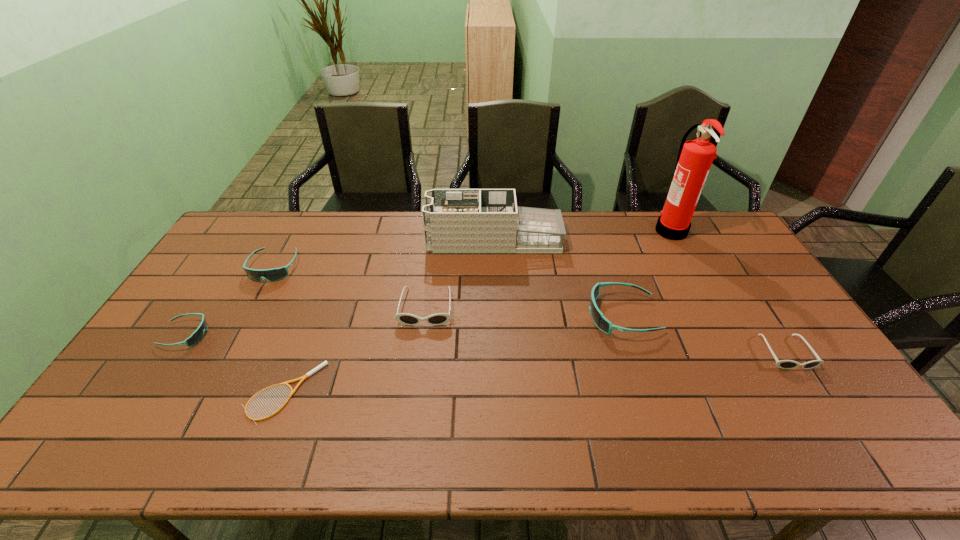
At what (x,y) coordinates should I click in order to perform the action: click on dollhouse present at the far edge. Please return your answer as a coordinate pair (x, y). Looking at the image, I should click on (455, 220).

This screenshot has height=540, width=960. I want to click on object located at the near edge, so click(325, 362).

Where is `fire extinguisher located in the right edge section of the desktop`? This screenshot has height=540, width=960. fire extinguisher located in the right edge section of the desktop is located at coordinates (695, 157).

This screenshot has height=540, width=960. I want to click on sunglasses at the right edge, so click(783, 364).

Locate an element on the screen. This screenshot has height=540, width=960. object that is at the far right corner is located at coordinates (695, 157).

Where is `free region at the far edge`? free region at the far edge is located at coordinates (359, 248).

This screenshot has height=540, width=960. In the image, there is a desktop. In order to click on free space at the near edge in this screenshot , I will do `click(393, 442)`.

Locate an element on the screen. blank area at the left edge is located at coordinates (185, 363).

Locate an element on the screen. This screenshot has width=960, height=540. free space at the right edge of the desktop is located at coordinates click(x=782, y=319).

You are a GUI agent. You are given a task and a screenshot of the screen. Output one action in this format:
    pyautogui.click(x=<x>, y=<y>)
    Task: Click on the free spot at the far left corner of the desktop
    
    Given the screenshot: What is the action you would take?
    pyautogui.click(x=231, y=233)